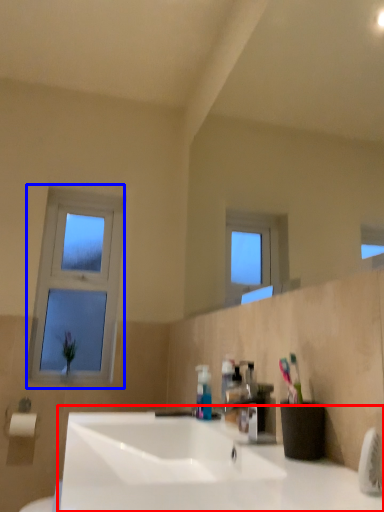
Question: Which of the following is the closest to the observer, sink (highlighted by a red box) or window (highlighted by a blue box)?

Choices:
 (A) sink
 (B) window

Answer: (A)